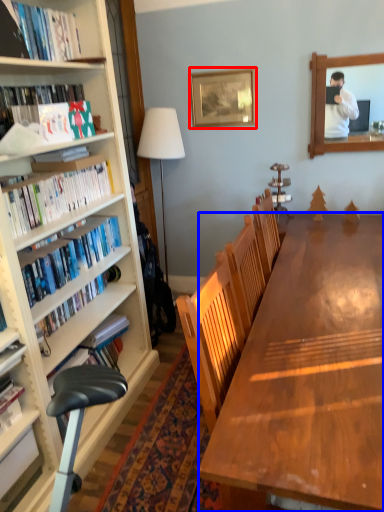
Question: Which of the following is the farthest to the observer, picture frame (highlighted by a red box) or desk (highlighted by a blue box)?

Choices:
 (A) picture frame
 (B) desk

Answer: (A)